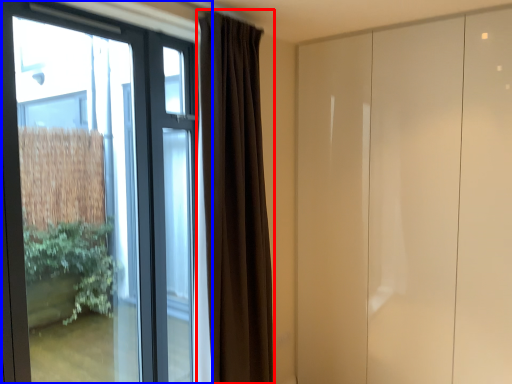
Question: Among these objects, which one is farthest to the camera, curtain (highlighted by a red box) or window (highlighted by a blue box)?

Choices:
 (A) curtain
 (B) window

Answer: (A)